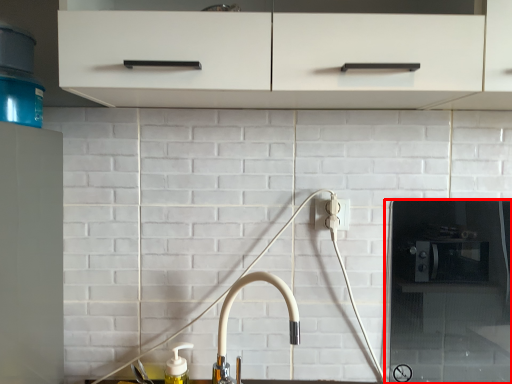
Question: Observing the image, what is the correct spatial positioning of appliance (annotated by the red box) in reference to tap?

Choices:
 (A) left
 (B) right

Answer: (B)